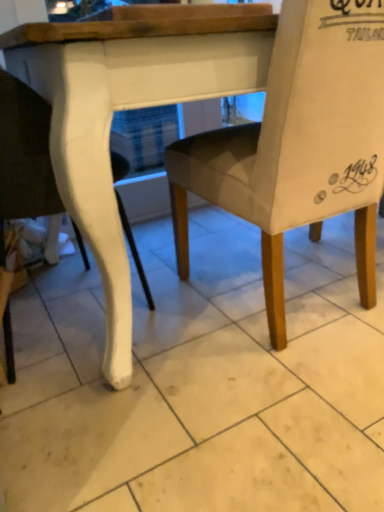
Question: Does light gray fabric chair at center, the second chair in the left-to-right sequence, have a smaller size compared to white glossy chair leg at left, which ranks as the 1th chair in left-to-right order?

Choices:
 (A) yes
 (B) no

Answer: (B)

Question: From the image's perspective, is light gray fabric chair at center, which appears as the first chair when viewed from the right, under white glossy chair leg at left, which ranks as the 1th chair in left-to-right order?

Choices:
 (A) no
 (B) yes

Answer: (A)

Question: Is light gray fabric chair at center, the second chair in the left-to-right sequence, shorter than white glossy chair leg at left, which ranks as the 1th chair in left-to-right order?

Choices:
 (A) no
 (B) yes

Answer: (B)

Question: Is light gray fabric chair at center, the second chair in the left-to-right sequence, wider than white glossy chair leg at left, the 2th chair positioned from the right?

Choices:
 (A) yes
 (B) no

Answer: (A)

Question: Is light gray fabric chair at center, which appears as the first chair when viewed from the right, looking in the opposite direction of white glossy chair leg at left, which ranks as the 1th chair in left-to-right order?

Choices:
 (A) yes
 (B) no

Answer: (B)

Question: Is light gray fabric chair at center, which appears as the first chair when viewed from the right, completely or partially outside of white glossy chair leg at left, the 2th chair positioned from the right?

Choices:
 (A) no
 (B) yes

Answer: (B)

Question: Is white glossy tile at center positioned far away from white glossy chair leg at left, the 2th chair positioned from the right?

Choices:
 (A) no
 (B) yes

Answer: (A)

Question: Is white glossy tile at center oriented towards white glossy chair leg at left, which ranks as the 1th chair in left-to-right order?

Choices:
 (A) no
 (B) yes

Answer: (A)

Question: From the image's perspective, is white glossy tile at center above white glossy chair leg at left, which ranks as the 1th chair in left-to-right order?

Choices:
 (A) yes
 (B) no

Answer: (B)

Question: From the image's perspective, is white glossy tile at center located beneath white glossy chair leg at left, the 2th chair positioned from the right?

Choices:
 (A) yes
 (B) no

Answer: (A)

Question: From a real-world perspective, is white glossy tile at center on top of white glossy chair leg at left, which ranks as the 1th chair in left-to-right order?

Choices:
 (A) yes
 (B) no

Answer: (B)

Question: Would you say white glossy tile at center is outside white glossy chair leg at left, the 2th chair positioned from the right?

Choices:
 (A) no
 (B) yes

Answer: (B)

Question: Can you confirm if white glossy chair leg at left, the 2th chair positioned from the right, is positioned to the right of white glossy tile at center?

Choices:
 (A) yes
 (B) no

Answer: (B)